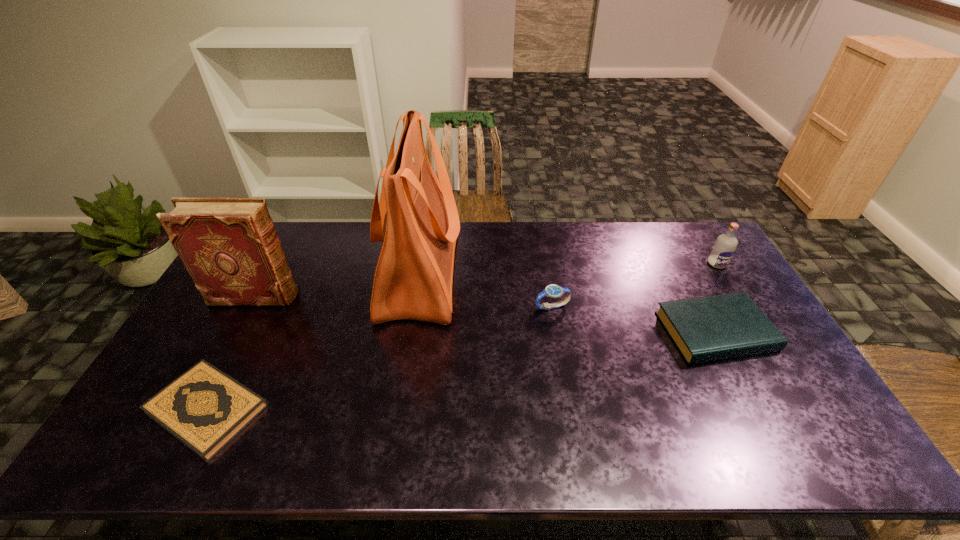
Where is `vacant space that's between the second shortest object and the tallest hardback book`? vacant space that's between the second shortest object and the tallest hardback book is located at coordinates (485, 314).

Where is `free spot between the vodka and the watch`? This screenshot has height=540, width=960. free spot between the vodka and the watch is located at coordinates (635, 285).

At what (x,y) coordinates should I click in order to perform the action: click on vacant space that's between the third object from right to left and the fourth shortest object. Please return your answer as a coordinate pair (x, y). Looking at the image, I should click on [635, 285].

Select which object appears as the fifth closest to the third tallest object. Please provide its 2D coordinates. Your answer should be formatted as a tuple, i.e. [(x, y)], where the tuple contains the x and y coordinates of a point satisfying the conditions above.

[(204, 408)]

The width and height of the screenshot is (960, 540). Identify the location of object that is the second closest one to the fourth object from right to left. tap(553, 291).

Identify which hardback book is located as the second nearest to the fifth tallest object. Please provide its 2D coordinates. Your answer should be formatted as a tuple, i.e. [(x, y)], where the tuple contains the x and y coordinates of a point satisfying the conditions above.

[(229, 246)]

This screenshot has width=960, height=540. In order to click on hardback book identified as the third closest to the watch in this screenshot , I will do `click(229, 246)`.

In order to click on free space that satisfies the following two spatial constraints: 1. on the spine side of the shortest hardback book; 2. on the left side of the tallest hardback book in this screenshot , I will do `click(194, 409)`.

What are the coordinates of `vacant space that satisfies the following two spatial constraints: 1. on the label of the vodka; 2. on the spine side of the tallest hardback book` in the screenshot? It's located at (737, 296).

Find the location of a particular element. free spot that satisfies the following two spatial constraints: 1. on the spine side of the shortest hardback book; 2. on the left side of the tallest hardback book is located at coordinates (194, 409).